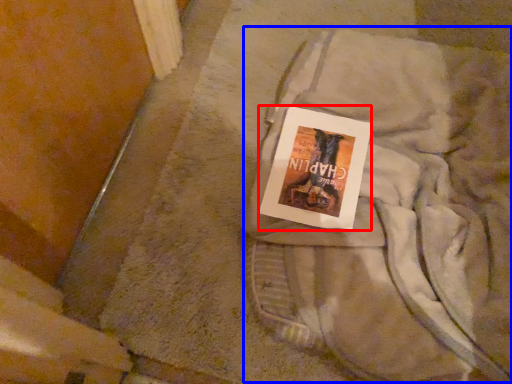
Question: Among these objects, which one is farthest to the camera, paperback book (highlighted by a red box) or laundry (highlighted by a blue box)?

Choices:
 (A) paperback book
 (B) laundry

Answer: (A)